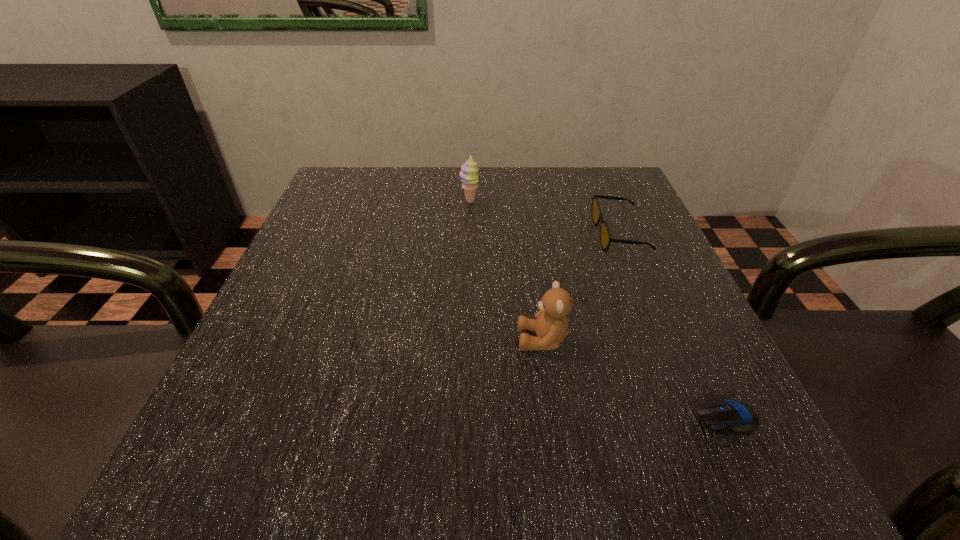
This screenshot has height=540, width=960. What are the coordinates of `free area in between the computer mouse and the sherbert` in the screenshot? It's located at (598, 309).

Where is `the third closest object relative to the nearest object`? Image resolution: width=960 pixels, height=540 pixels. the third closest object relative to the nearest object is located at coordinates (469, 171).

Point out which object is positioned as the nearest to the third farthest object. Please provide its 2D coordinates. Your answer should be formatted as a tuple, i.e. [(x, y)], where the tuple contains the x and y coordinates of a point satisfying the conditions above.

[(718, 413)]